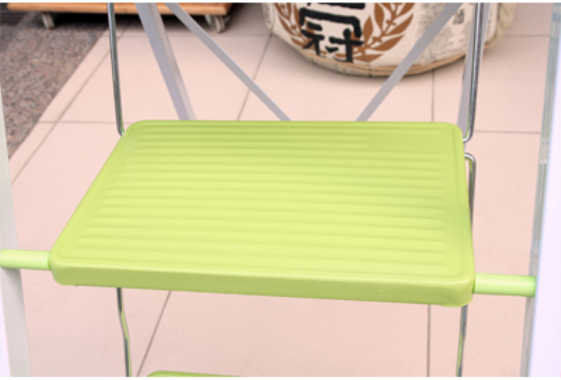
What are the coordinates of `bottom portion of side table` in the screenshot? It's located at (49, 7).